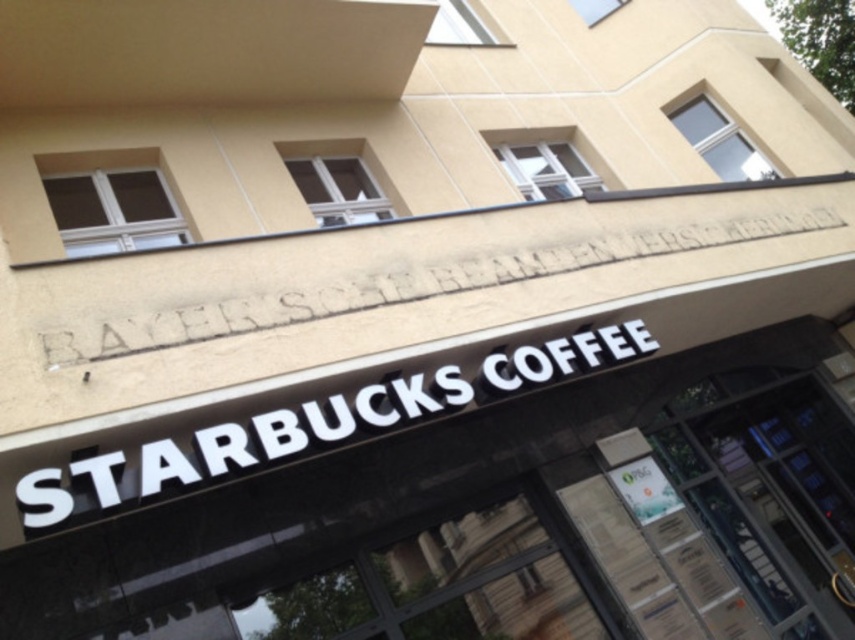
You are standing in front of the Starbucks Coffee shop exterior. You need to locate the transparent glass door at center. Where exactly is it positioned?

The transparent glass door at center is positioned at point 0.766 on the x axis and 0.902 on the y axis.

You are standing in front of the Starbucks Coffee shop building. There are two points marked on the facade. The first point is at coordinate (703, 444) and the second is at (49, 492). Which point is closer to you?

Point (49, 492) is closer to you because it is nearer to the camera than point (703, 444).

Based on the photo, you are a delivery person trying to enter the Starbucks Coffee shop. You see the transparent glass door at center and the white stone engraving at center. Which object is closer to you as you approach the building?

The transparent glass door at center is closer to you because it is in front of the white stone engracing at center.